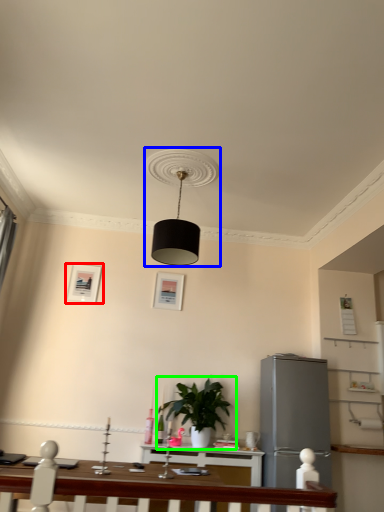
Question: Estimate the real-world distances between objects in this image. Which object is closer to picture frame (highlighted by a red box), lamp (highlighted by a blue box) or houseplant (highlighted by a green box)?

Choices:
 (A) lamp
 (B) houseplant

Answer: (B)